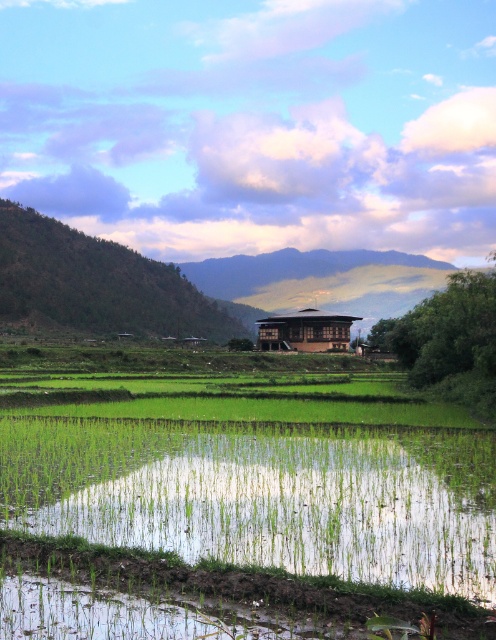
Question: Does green grassy field at center come in front of brown wooden hut at center?

Choices:
 (A) yes
 (B) no

Answer: (A)

Question: Does green grassy field at center appear over brown wooden hut at center?

Choices:
 (A) yes
 (B) no

Answer: (B)

Question: Does green grassy field at center appear over brown wooden hut at center?

Choices:
 (A) no
 (B) yes

Answer: (A)

Question: Which point is closer to the camera taking this photo?

Choices:
 (A) click(274, 492)
 (B) click(315, 349)

Answer: (A)

Question: Which object is farther from the camera taking this photo?

Choices:
 (A) green grassy field at center
 (B) brown wooden hut at center

Answer: (B)